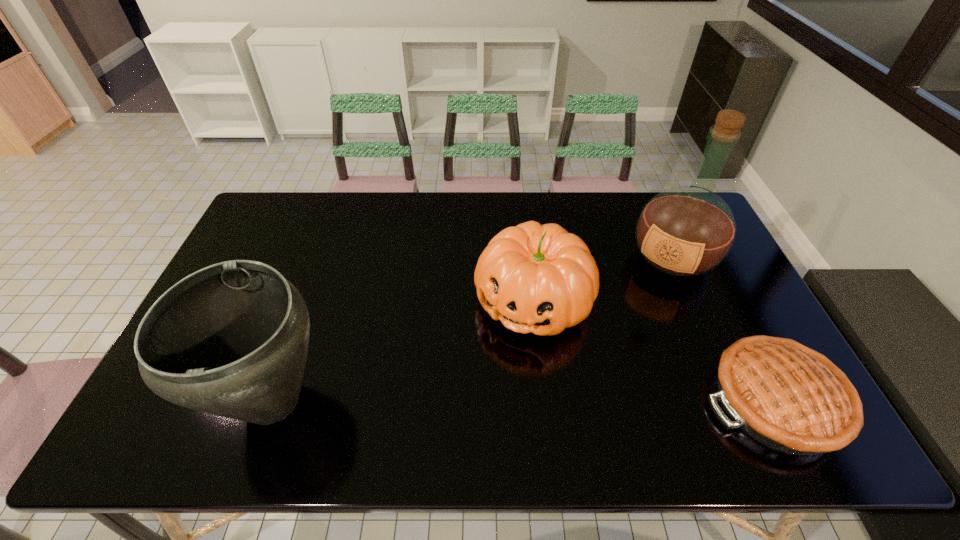
This screenshot has height=540, width=960. I want to click on free location that satisfies the following two spatial constraints: 1. on the front side of the tallest object; 2. on the right side of the shortest object, so click(x=736, y=401).

At what (x,y) coordinates should I click in order to perform the action: click on free space in the image that satisfies the following two spatial constraints: 1. on the front side of the tallest object; 2. on the left side of the shortest object. Please return your answer as a coordinate pair (x, y). The height and width of the screenshot is (540, 960). Looking at the image, I should click on (736, 401).